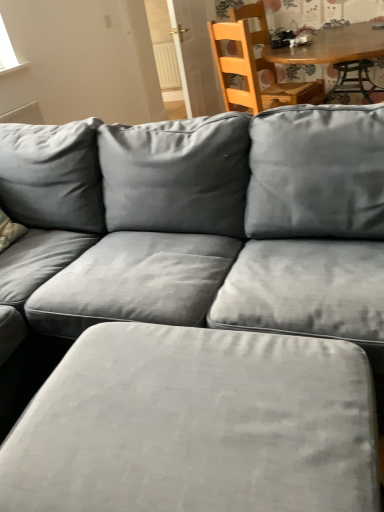
Question: From the image's perspective, is white plastic radiator at upper center located above or below suede gray ottoman at lower center?

Choices:
 (A) above
 (B) below

Answer: (A)

Question: Is white plastic radiator at upper center situated inside suede gray ottoman at lower center or outside?

Choices:
 (A) outside
 (B) inside

Answer: (A)

Question: Estimate the real-world distances between objects in this image. Which object is closer to the wooden table at upper center?

Choices:
 (A) white plastic radiator at upper center
 (B) wooden chair at upper right
 (C) suede gray ottoman at lower center

Answer: (B)

Question: Which of these objects is positioned farthest from the white plastic radiator at upper center?

Choices:
 (A) wooden table at upper center
 (B) wooden chair at upper right
 (C) suede gray ottoman at lower center

Answer: (C)